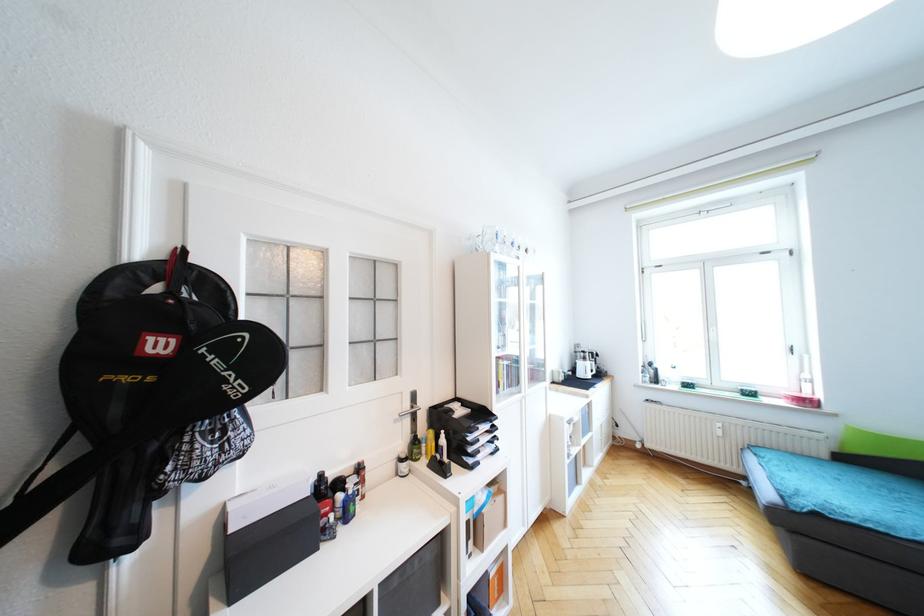
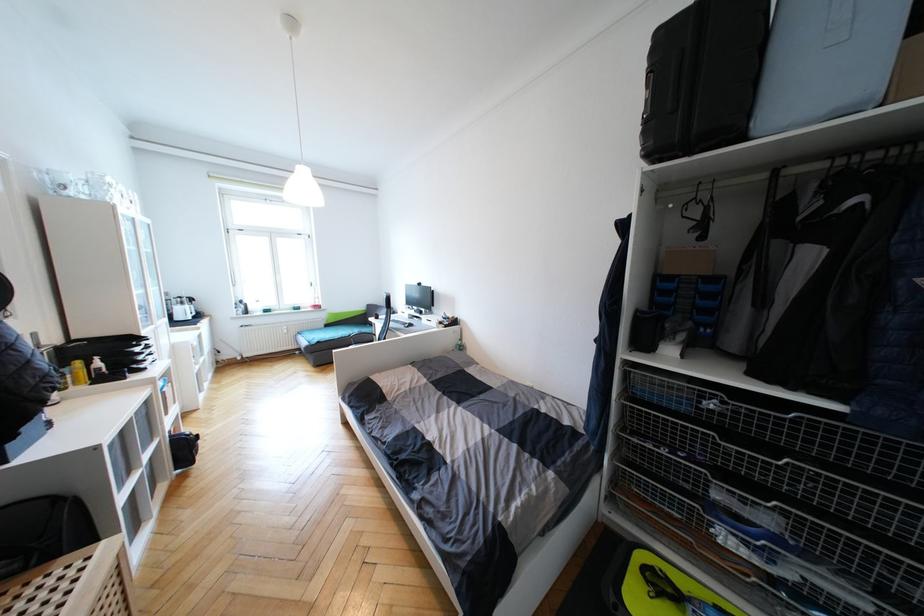
Where in the second image is the point corresponding to pixel 434 435 from the first image?

(81, 363)